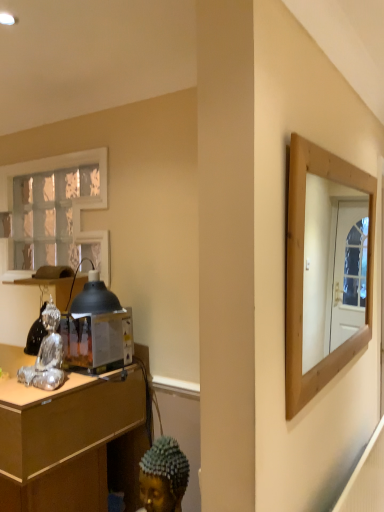
Question: Is white textured glass at upper left wider or thinner than silver metallic figurine at left?

Choices:
 (A) wide
 (B) thin

Answer: (A)

Question: Visually, is white textured glass at upper left positioned to the left or to the right of silver metallic figurine at left?

Choices:
 (A) right
 (B) left

Answer: (B)

Question: Which of these objects is positioned closest to the metallic/reflective toaster at left?

Choices:
 (A) silver metallic figurine at left
 (B) white textured glass at upper left
 (C) wooden desk at left

Answer: (A)

Question: Which object is the farthest from the white textured glass at upper left?

Choices:
 (A) metallic/reflective toaster at left
 (B) wooden desk at left
 (C) silver metallic figurine at left

Answer: (B)